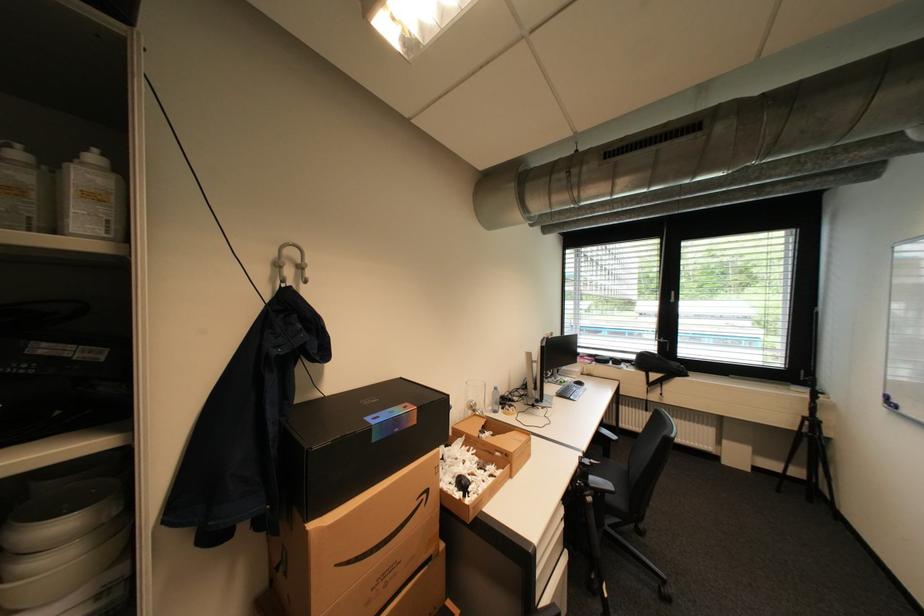
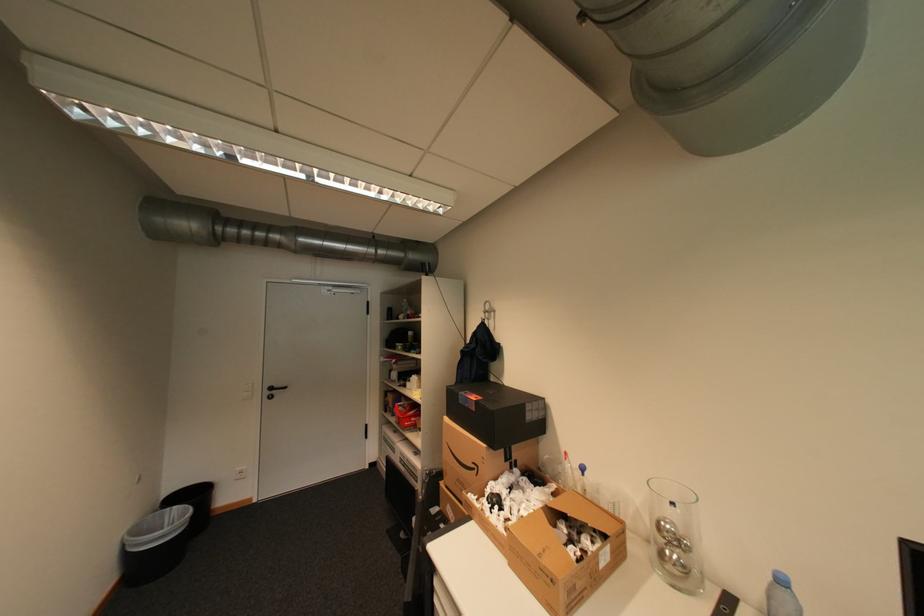
The point at (405, 431) is marked in the first image. Where is the corresponding point in the second image?

(476, 406)